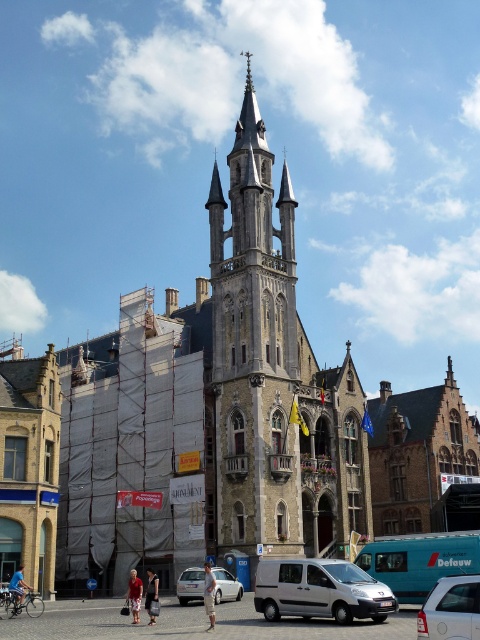
Question: In this image, where is silver metallic van at center located relative to red cotton shorts at lower center?

Choices:
 (A) left
 (B) right

Answer: (B)

Question: Which point is closer to the camera?

Choices:
 (A) [453, 577]
 (B) [136, 580]
 (C) [317, 572]

Answer: (A)

Question: Which object appears closest to the camera in this image?

Choices:
 (A) silver metallic van at center
 (B) red cotton shorts at lower center

Answer: (A)

Question: From the image, what is the correct spatial relationship of denim shorts at lower center in relation to blue denim shorts at center?

Choices:
 (A) left
 (B) right

Answer: (B)

Question: Can you confirm if white matte car at center is positioned to the left of red cotton shorts at lower center?

Choices:
 (A) yes
 (B) no

Answer: (B)

Question: Which object is farther from the camera taking this photo?

Choices:
 (A) blue denim shorts at center
 (B) silver metallic hatchback at center
 (C) white matte car at center

Answer: (A)